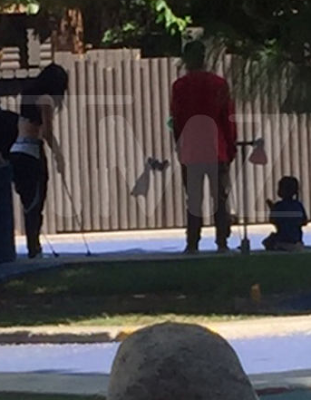
You are a GUI agent. You are given a task and a screenshot of the screen. Output one action in this format:
    pyautogui.click(x=<x>, y=<y>)
    Task: Click on the lamp
    The width and height of the screenshot is (311, 400).
    Given the screenshot: What is the action you would take?
    pyautogui.click(x=257, y=145)